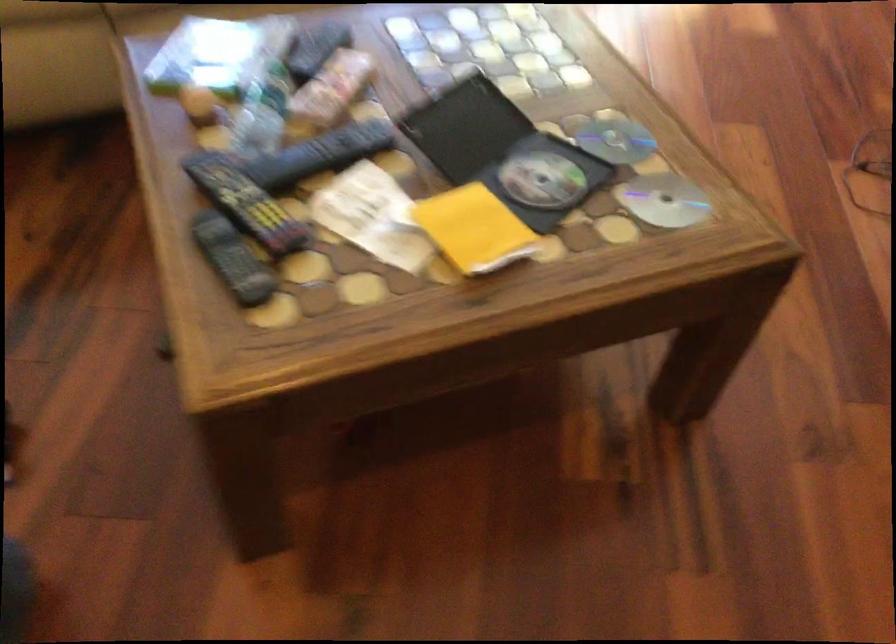
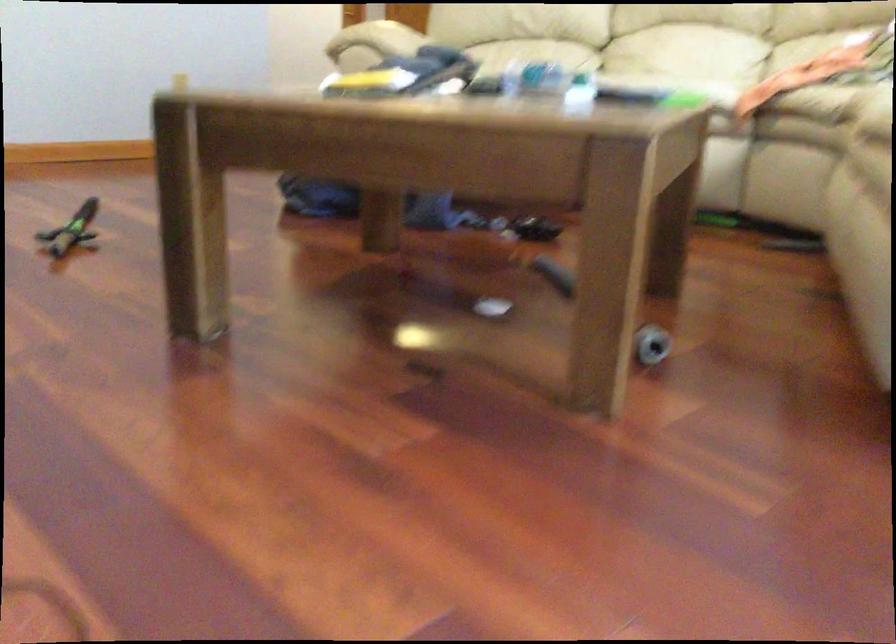
Question: I am providing you with two images of the same scene from different viewpoints. After the viewpoint changes to image2, which objects are now occluded?

Choices:
 (A) green toy sword
 (B) sofa sitting surface
 (C) small blue package
 (D) black DVD case

Answer: (D)